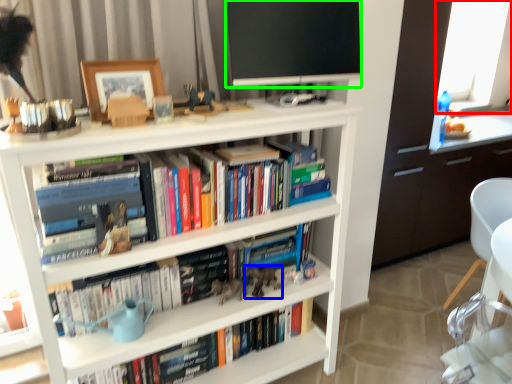
Question: Estimate the real-world distances between objects in this image. Which object is farther from window screen (highlighted by a red box), toy (highlighted by a blue box) or television (highlighted by a green box)?

Choices:
 (A) toy
 (B) television

Answer: (A)